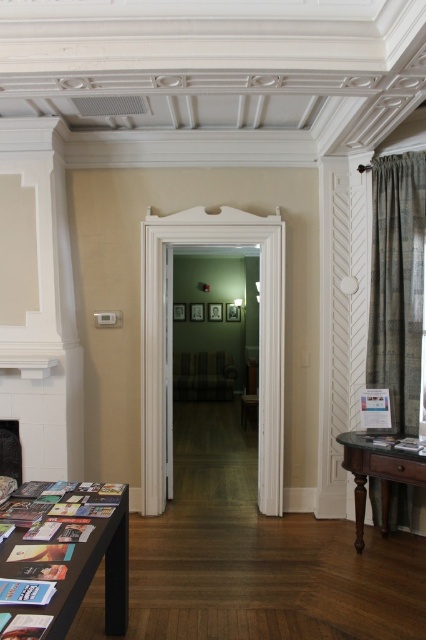
Question: Does black glossy table at lower left appear on the right side of mahogany wood table at right?

Choices:
 (A) yes
 (B) no

Answer: (B)

Question: Can you confirm if black glossy table at lower left is positioned above black stone fireplace at lower left?

Choices:
 (A) no
 (B) yes

Answer: (A)

Question: Which object is the farthest from the black stone fireplace at lower left?

Choices:
 (A) black glossy table at lower left
 (B) mahogany wood table at right

Answer: (B)

Question: Does mahogany wood table at right appear on the right side of black stone fireplace at lower left?

Choices:
 (A) yes
 (B) no

Answer: (A)

Question: Which object is farther from the camera taking this photo?

Choices:
 (A) black glossy table at lower left
 (B) mahogany wood table at right
 (C) textured green curtain at right

Answer: (C)

Question: Which of the following is the closest to the observer?

Choices:
 (A) (414, 230)
 (B) (402, 468)
 (C) (0, 454)
 (D) (104, 529)

Answer: (D)